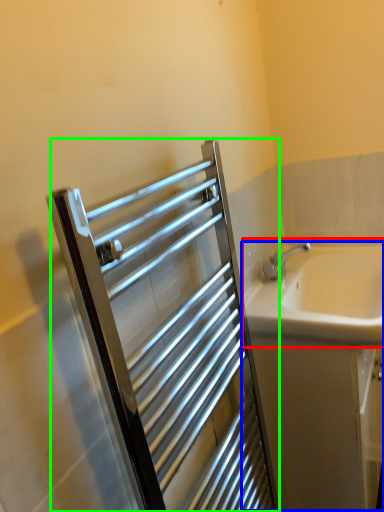
Question: Which is farther away from sink (highlighted by a red box)? bath (highlighted by a blue box) or screen door (highlighted by a green box)?

Choices:
 (A) bath
 (B) screen door

Answer: (B)